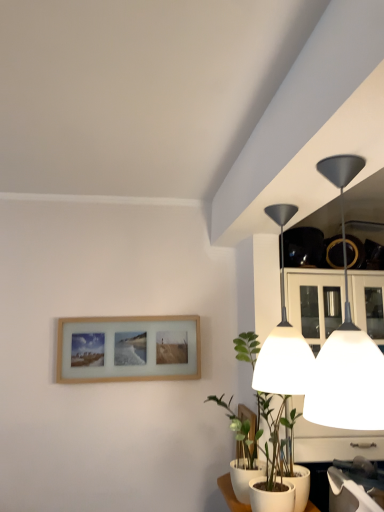
Question: Is wooden picture frame at lower center, the second picture frame positioned from the top, completely or partially outside of wooden picture frame at lower left, the first picture frame in the left-to-right sequence?

Choices:
 (A) no
 (B) yes

Answer: (B)

Question: Considering the relative positions of wooden picture frame at lower center, acting as the first picture frame starting from the front, and wooden picture frame at lower left, the 1th picture frame positioned from the top, in the image provided, is wooden picture frame at lower center, acting as the first picture frame starting from the front, behind wooden picture frame at lower left, the 1th picture frame positioned from the top,?

Choices:
 (A) no
 (B) yes

Answer: (A)

Question: Is the depth of wooden picture frame at lower center, placed as the first picture frame when sorted from right to left, less than that of wooden picture frame at lower left, the 2th picture frame when ordered from front to back?

Choices:
 (A) yes
 (B) no

Answer: (A)

Question: From a real-world perspective, is wooden picture frame at lower center, placed as the 1th picture frame when sorted from bottom to top, under wooden picture frame at lower left, arranged as the second picture frame when ordered from the bottom?

Choices:
 (A) no
 (B) yes

Answer: (B)

Question: Does wooden picture frame at lower center, the second picture frame positioned from the top, have a smaller size compared to wooden picture frame at lower left, the 2th picture frame when ordered from front to back?

Choices:
 (A) no
 (B) yes

Answer: (B)

Question: Does wooden picture frame at lower center, which appears as the second picture frame when viewed from the left, have a lesser width compared to wooden picture frame at lower left, the 2th picture frame when ordered from front to back?

Choices:
 (A) yes
 (B) no

Answer: (B)

Question: Is there a large distance between white matte lampshade at upper right, which is the second lamp from front to back, and green matte plant at lower right?

Choices:
 (A) yes
 (B) no

Answer: (B)

Question: Can you see white matte lampshade at upper right, the first lamp when ordered from back to front, touching green matte plant at lower right?

Choices:
 (A) no
 (B) yes

Answer: (A)

Question: Can you confirm if white matte lampshade at upper right, the first lamp when ordered from back to front, is taller than green matte plant at lower right?

Choices:
 (A) no
 (B) yes

Answer: (A)

Question: Does white matte lampshade at upper right, which is the second lamp from front to back, have a larger size compared to green matte plant at lower right?

Choices:
 (A) yes
 (B) no

Answer: (B)

Question: From a real-world perspective, is white matte lampshade at upper right, the first lamp when ordered from back to front, under green matte plant at lower right?

Choices:
 (A) yes
 (B) no

Answer: (B)

Question: Could you tell me if white matte lampshade at upper right, the first lamp when ordered from back to front, is turned towards green matte plant at lower right?

Choices:
 (A) no
 (B) yes

Answer: (A)

Question: From a real-world perspective, does wooden picture frame at lower center, acting as the first picture frame starting from the front, stand above matte black lampshade at upper right, which is the 1th lamp from front to back?

Choices:
 (A) no
 (B) yes

Answer: (A)